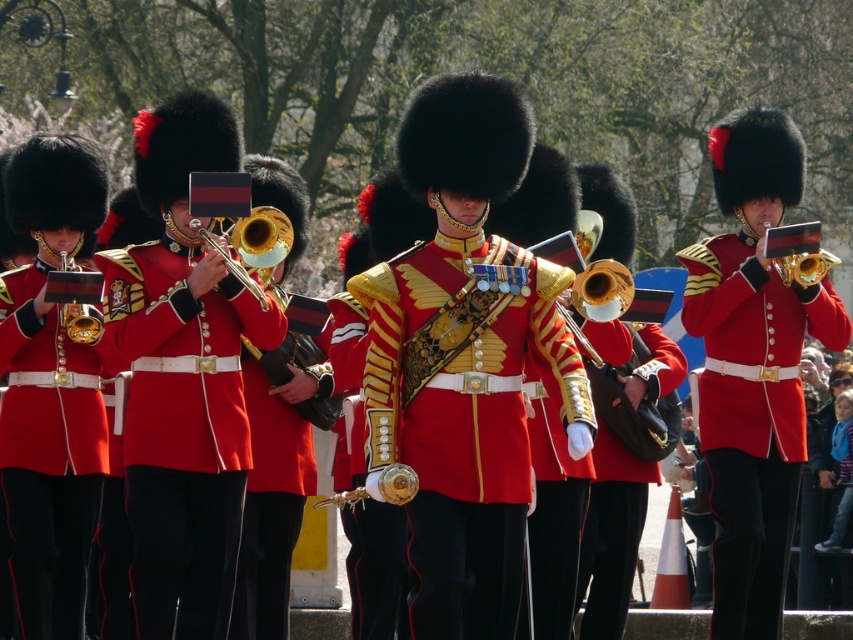
Question: Which object is farther from the camera taking this photo?

Choices:
 (A) shiny black leather bag at center
 (B) matte gold trumpet at center
 (C) gold brass trumpet at center
 (D) shiny gold sword at center

Answer: (C)

Question: Does matte gold trumpet at left have a lesser width compared to gold brass trumpet at center?

Choices:
 (A) no
 (B) yes

Answer: (A)

Question: Does shiny gold uniform at center come behind shiny black leather bag at center?

Choices:
 (A) yes
 (B) no

Answer: (B)

Question: Which object appears closest to the camera in this image?

Choices:
 (A) gold-plated trumpet at left
 (B) shiny black leather bag at center

Answer: (B)

Question: Which of the following is the farthest from the observer?

Choices:
 (A) (514, 513)
 (B) (386, 570)
 (C) (164, 586)

Answer: (B)

Question: Does shiny gold uniform at center appear over shiny gold trumpet at left?

Choices:
 (A) yes
 (B) no

Answer: (B)